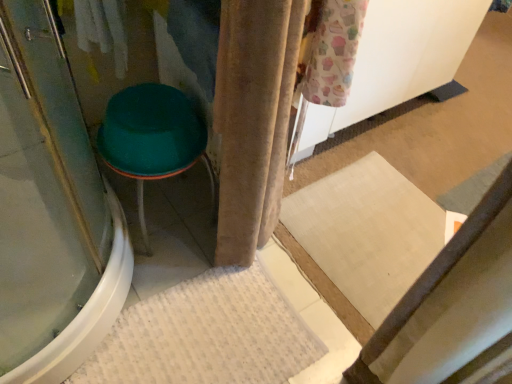
Question: Is beige velvet curtain at center bigger or smaller than white textured bath mat at lower center?

Choices:
 (A) small
 (B) big

Answer: (B)

Question: Does point (267, 175) appear closer or farther from the camera than point (257, 301)?

Choices:
 (A) closer
 (B) farther

Answer: (A)

Question: Estimate the real-world distances between objects in this image. Which object is farther from the white textured bath mat at lower center?

Choices:
 (A) beige velvet curtain at center
 (B) green plastic stool at left
 (C) transparent glass screen door at left

Answer: (B)

Question: Which of these objects is positioned farthest from the transparent glass screen door at left?

Choices:
 (A) white textured bath mat at lower center
 (B) green plastic stool at left
 (C) beige velvet curtain at center

Answer: (C)